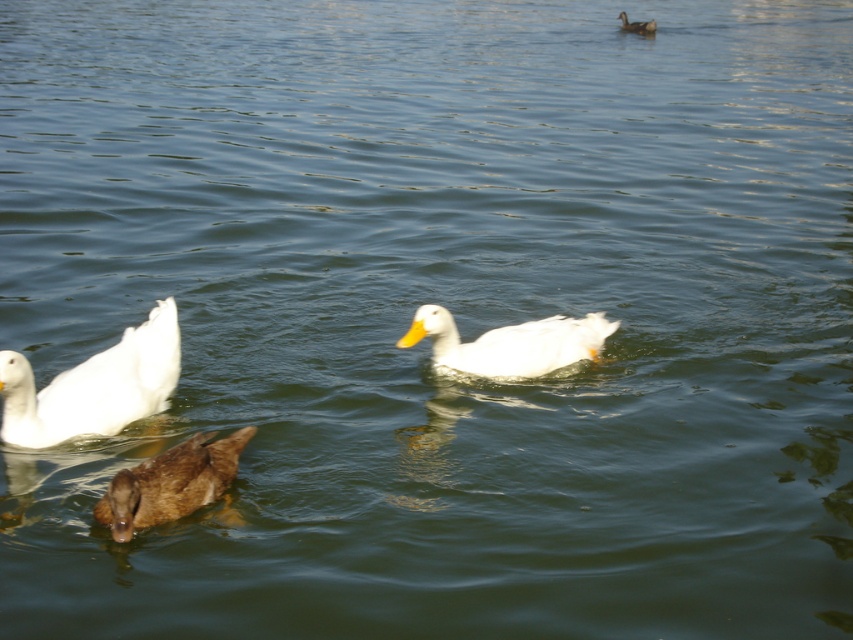
Between brown matte duck at center and white matte duck at upper right, which one is positioned lower?

brown matte duck at center is below.

This screenshot has height=640, width=853. Describe the element at coordinates (170, 483) in the screenshot. I see `brown matte duck at center` at that location.

Between point (109, 486) and point (654, 29), which one is positioned in front?

Positioned in front is point (109, 486).

Identify the location of brown matte duck at center. The height and width of the screenshot is (640, 853). (170, 483).

In the scene shown: Is white matte duck at lower left wider than white matte duck at upper right?

Correct, the width of white matte duck at lower left exceeds that of white matte duck at upper right.

Is white matte duck at lower left below white matte duck at upper right?

Yes.

Is point (171, 339) positioned after point (621, 26)?

No, it is not.

This screenshot has height=640, width=853. What are the coordinates of `white matte duck at lower left` in the screenshot? It's located at (93, 385).

Does white matte duck at lower left have a lesser height compared to white matte duck at center?

In fact, white matte duck at lower left may be taller than white matte duck at center.

Is point (94, 404) positioned behind point (601, 336)?

That is False.

Locate an element on the screen. white matte duck at lower left is located at coordinates (93, 385).